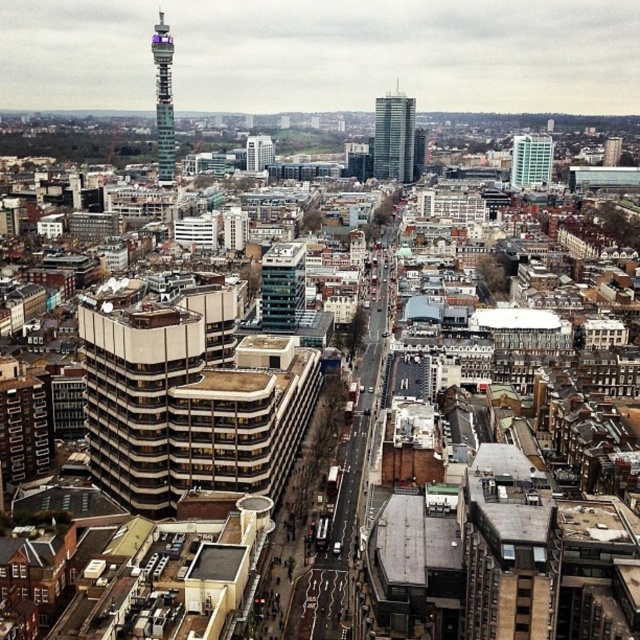
Question: Is glassy teal skyscraper at upper right in front of white glass building at center?

Choices:
 (A) yes
 (B) no

Answer: (B)

Question: Is green glass building at center further to the viewer compared to glassy teal skyscraper at upper right?

Choices:
 (A) yes
 (B) no

Answer: (B)

Question: Can you confirm if metallic glass tower at upper left is positioned below white glass building at center?

Choices:
 (A) no
 (B) yes

Answer: (A)

Question: Estimate the real-world distances between objects in this image. Which object is closer to the metallic glass tower at upper left?

Choices:
 (A) green glass building at center
 (B) glassy teal skyscraper at upper right
 (C) white glass building at center

Answer: (C)

Question: Based on their relative distances, which object is farther from the glassy teal skyscraper at upper right?

Choices:
 (A) green glass building at center
 (B) glassy reflective skyscraper at center
 (C) white glass building at center

Answer: (A)

Question: Which of the following is the farthest from the observer?

Choices:
 (A) (376, 161)
 (B) (157, 32)
 (C) (516, 141)

Answer: (C)